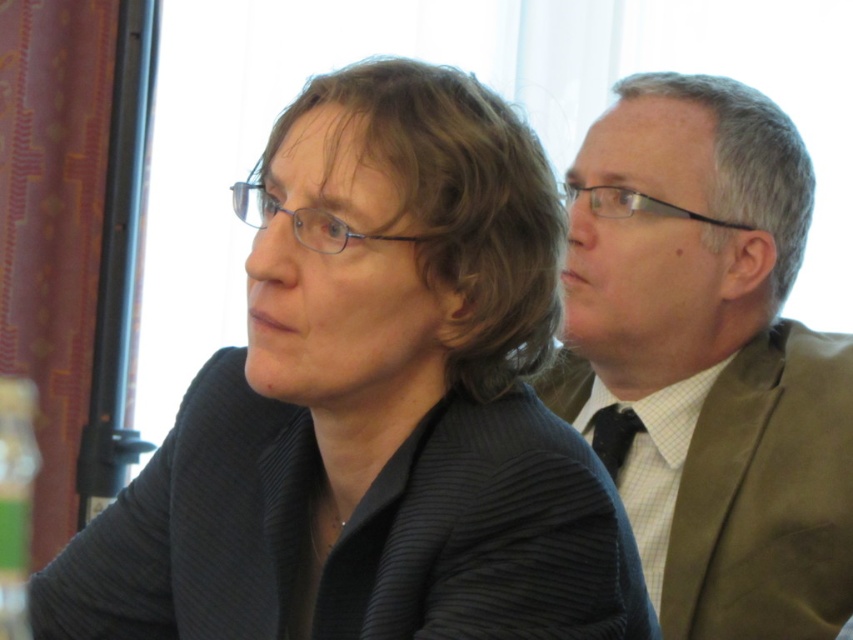
Question: Which object is farther from the camera taking this photo?

Choices:
 (A) matte olive-green suit at right
 (B) black textured blazer at center

Answer: (A)

Question: Is black textured blazer at center closer to camera compared to matte olive-green suit at right?

Choices:
 (A) yes
 (B) no

Answer: (A)

Question: Can you confirm if black textured blazer at center is thinner than matte olive-green suit at right?

Choices:
 (A) no
 (B) yes

Answer: (A)

Question: Which object appears closest to the camera in this image?

Choices:
 (A) matte olive-green suit at right
 (B) black textured blazer at center

Answer: (B)

Question: Among these points, which one is farthest from the camera?

Choices:
 (A) (763, 337)
 (B) (325, 202)

Answer: (A)

Question: Is black textured blazer at center wider than matte olive-green suit at right?

Choices:
 (A) yes
 (B) no

Answer: (A)